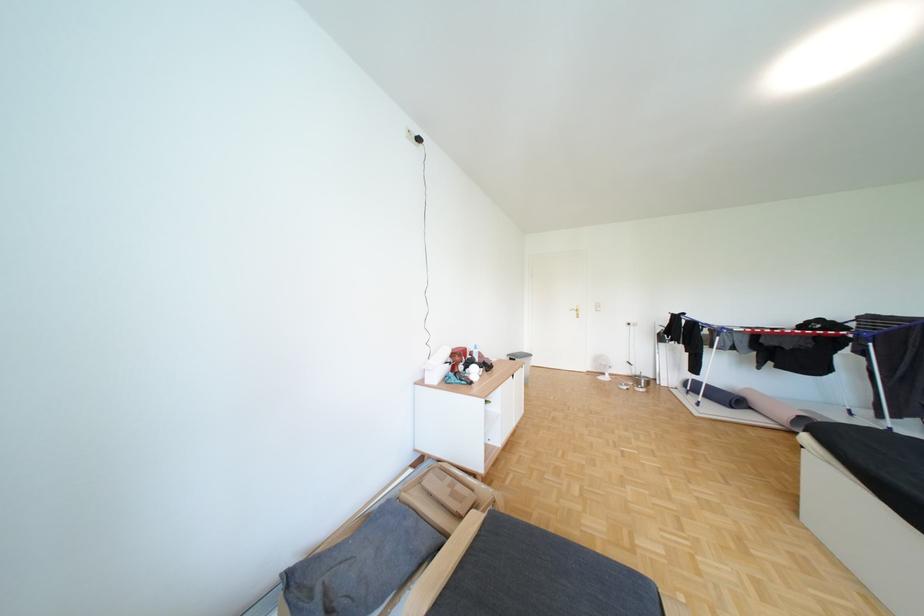
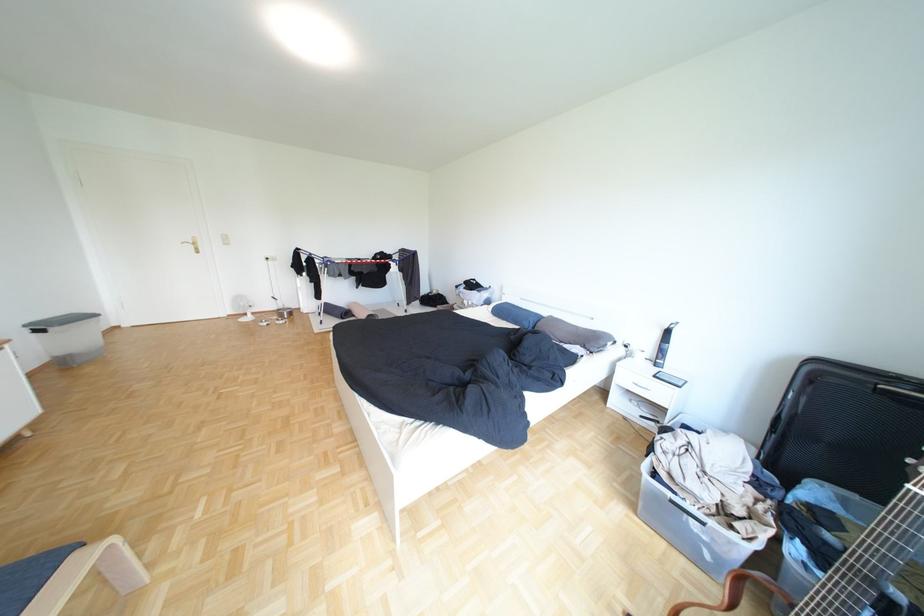
In the second image, find the point that corresponds to (639,371) in the first image.

(286, 307)